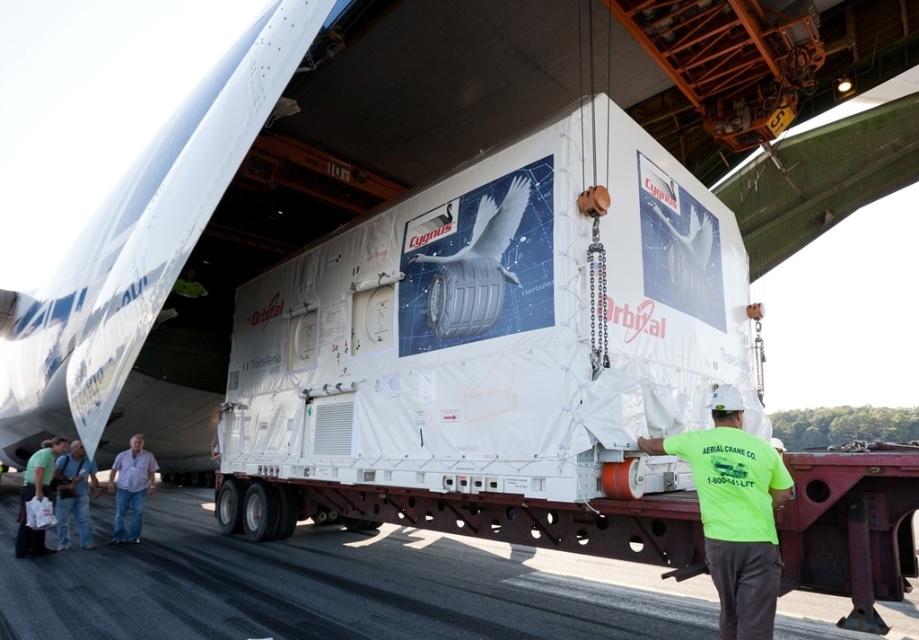
Question: Which point appears closest to the camera in this image?

Choices:
 (A) (40, 481)
 (B) (74, 452)
 (C) (126, 472)

Answer: (A)

Question: In this image, where is neon green t-shirt at lower right located relative to denim pants at lower left?

Choices:
 (A) left
 (B) right

Answer: (B)

Question: Does asphalt at lower center have a greater width compared to neon green t-shirt at lower left?

Choices:
 (A) yes
 (B) no

Answer: (A)

Question: Estimate the real-world distances between objects in this image. Which object is closer to the neon green t-shirt at lower left?

Choices:
 (A) asphalt at lower center
 (B) neon green t-shirt at lower right
 (C) denim pants at lower left

Answer: (C)

Question: Which point appears closest to the camera in this image?

Choices:
 (A) (135, 436)
 (B) (910, 595)

Answer: (B)

Question: Is neon green t-shirt at lower right wider than neon green t-shirt at lower left?

Choices:
 (A) yes
 (B) no

Answer: (A)